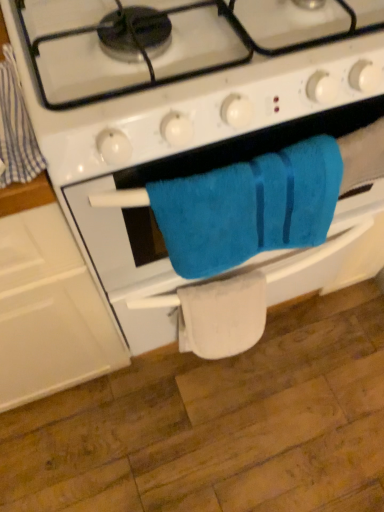
Question: Can you confirm if turquoise soft towel at center is positioned to the right of white fabric towel at lower center?

Choices:
 (A) no
 (B) yes

Answer: (B)

Question: Is turquoise soft towel at center positioned before white fabric towel at lower center?

Choices:
 (A) no
 (B) yes

Answer: (B)

Question: Is white fabric towel at lower center at the back of turquoise soft towel at center?

Choices:
 (A) no
 (B) yes

Answer: (A)

Question: Is turquoise soft towel at center positioned behind white fabric towel at lower center?

Choices:
 (A) yes
 (B) no

Answer: (B)

Question: From a real-world perspective, is turquoise soft towel at center physically below white fabric towel at lower center?

Choices:
 (A) yes
 (B) no

Answer: (B)

Question: In terms of height, does turquoise soft towel at center look taller or shorter compared to blue cotton towel at left?

Choices:
 (A) short
 (B) tall

Answer: (B)

Question: Is turquoise soft towel at center wider or thinner than blue cotton towel at left?

Choices:
 (A) thin
 (B) wide

Answer: (A)

Question: Relative to blue cotton towel at left, is turquoise soft towel at center in front or behind?

Choices:
 (A) behind
 (B) front

Answer: (A)

Question: From the image's perspective, is turquoise soft towel at center positioned above or below blue cotton towel at left?

Choices:
 (A) above
 (B) below

Answer: (B)

Question: Is white fabric towel at lower center bigger or smaller than blue soft towel at center?

Choices:
 (A) small
 (B) big

Answer: (A)

Question: From the image's perspective, is white fabric towel at lower center located above or below blue soft towel at center?

Choices:
 (A) above
 (B) below

Answer: (B)

Question: Would you say white fabric towel at lower center is inside or outside blue soft towel at center?

Choices:
 (A) inside
 (B) outside

Answer: (A)

Question: Does point (188, 287) appear closer or farther from the camera than point (87, 76)?

Choices:
 (A) farther
 (B) closer

Answer: (A)

Question: In terms of size, does blue cotton towel at left appear bigger or smaller than blue soft towel at center?

Choices:
 (A) big
 (B) small

Answer: (B)

Question: Is point (8, 117) closer or farther from the camera than point (382, 109)?

Choices:
 (A) closer
 (B) farther

Answer: (A)